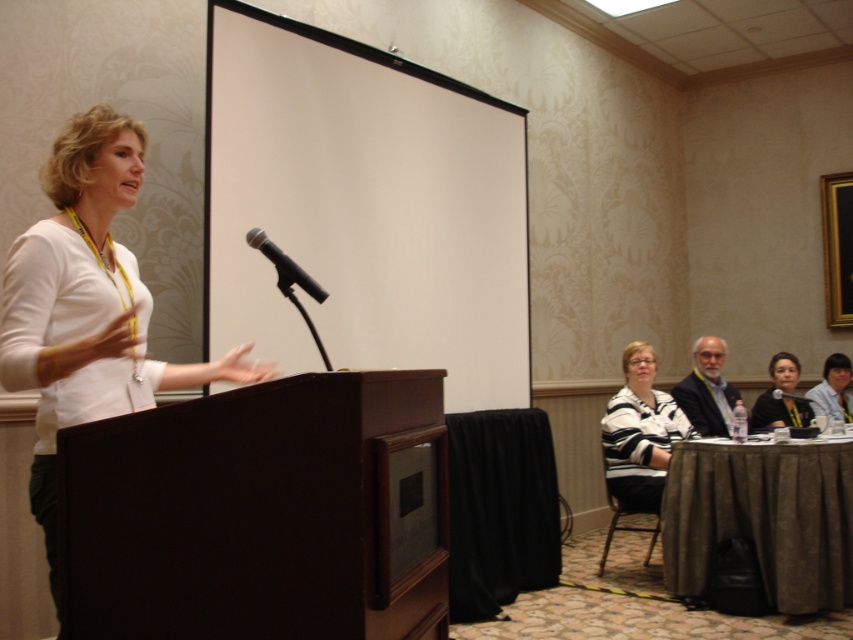
Question: Does brown fabric table at lower right appear over metallic silver microphone at center?

Choices:
 (A) no
 (B) yes

Answer: (A)

Question: Based on their relative distances, which object is nearer to the dark brown suit at lower right?

Choices:
 (A) striped sweater at center
 (B) metallic silver microphone at center

Answer: (A)

Question: Which of the following is the closest to the observer?

Choices:
 (A) brown fabric table at lower right
 (B) white matte shirt at left

Answer: (B)

Question: Can you confirm if striped sweater at center is positioned to the left of matte white shirt at center?

Choices:
 (A) yes
 (B) no

Answer: (A)

Question: Considering the real-world distances, which object is closest to the brown fabric table at lower right?

Choices:
 (A) matte black shirt at lower right
 (B) black plastic microphone at center

Answer: (A)

Question: Is brown fabric table at lower right to the left of matte white shirt at center from the viewer's perspective?

Choices:
 (A) no
 (B) yes

Answer: (B)